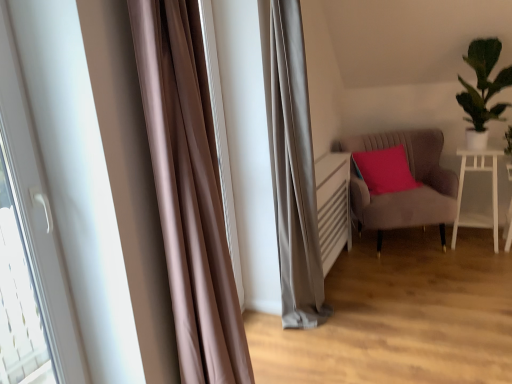
You are a GUI agent. You are given a task and a screenshot of the screen. Output one action in this format:
    pyautogui.click(x=<x>, y=<y>)
    Task: Click on the empty space that is to the right of satin brown curtain at left
    This screenshot has width=512, height=384.
    Given the screenshot: What is the action you would take?
    pyautogui.click(x=345, y=336)